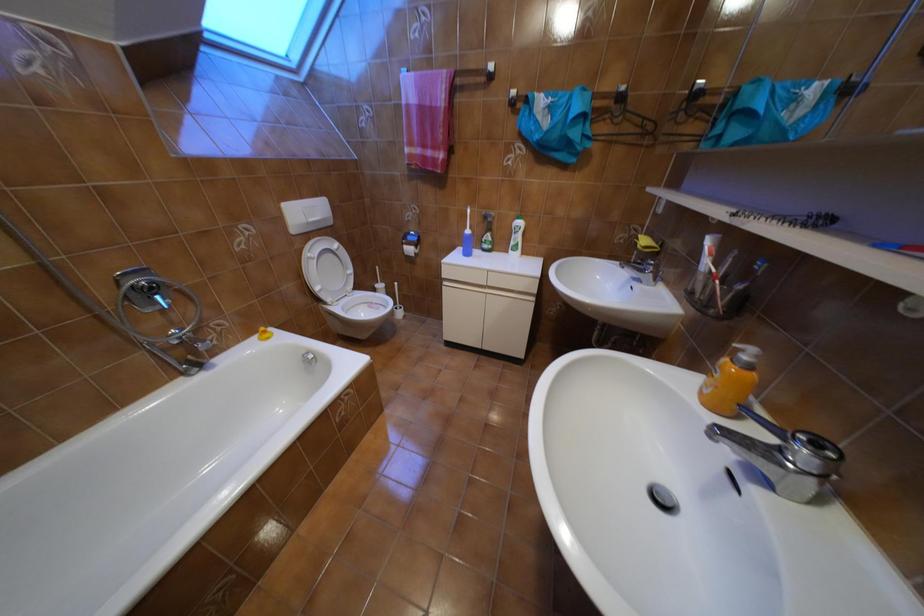
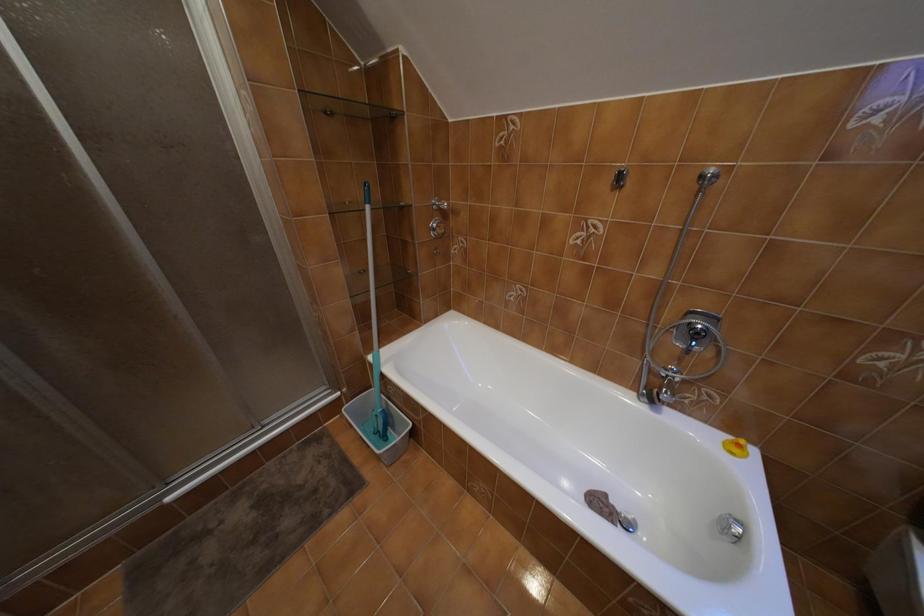
The first image is from the beginning of the video and the second image is from the end. How did the camera likely rotate when shooting the video?

The camera rotated toward left-down.